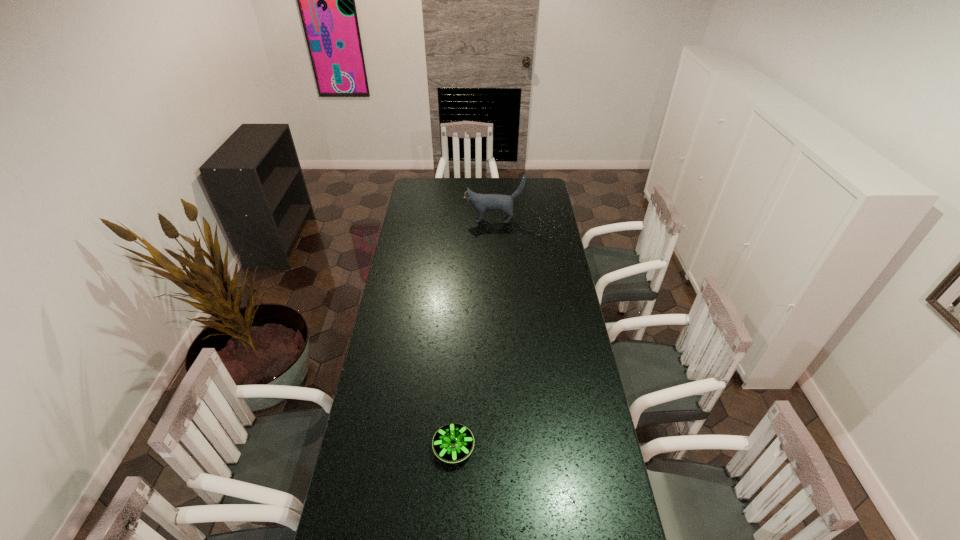
The image size is (960, 540). I want to click on vacant space at the far right corner of the desktop, so click(533, 186).

Image resolution: width=960 pixels, height=540 pixels. What are the coordinates of `unoccupied area between the taller object and the shorter object` in the screenshot? It's located at (473, 334).

Where is `vacant point that satisfies the following two spatial constraints: 1. at the face of the farther object; 2. on the front side of the shorter object`? vacant point that satisfies the following two spatial constraints: 1. at the face of the farther object; 2. on the front side of the shorter object is located at coordinates (502, 448).